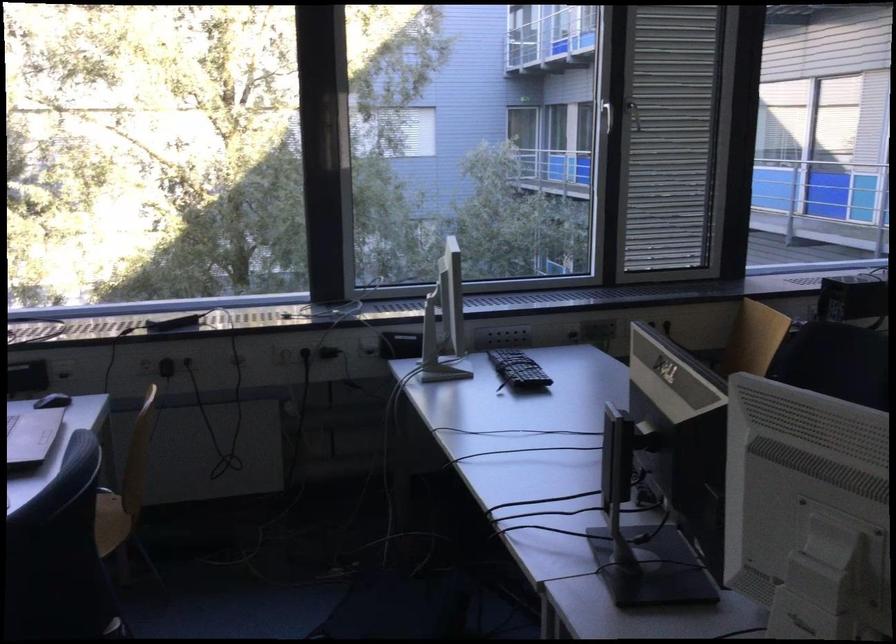
Image resolution: width=896 pixels, height=644 pixels. Identify the location of chair sitting surface. (109, 522).